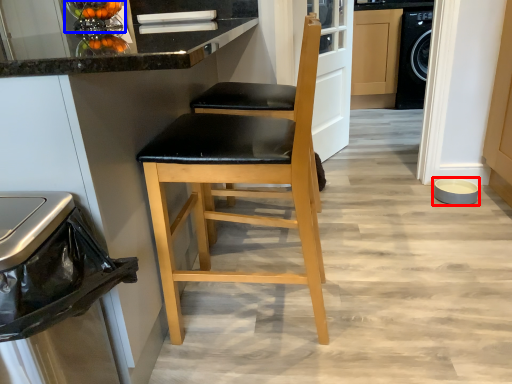
Question: Which point is further to the camera, appliance (highlighted by a red box) or appliance (highlighted by a blue box)?

Choices:
 (A) appliance
 (B) appliance

Answer: (A)